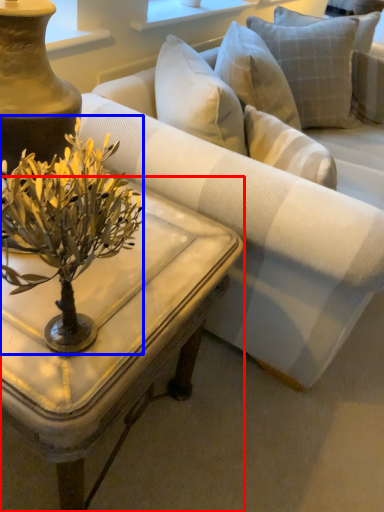
Question: Which object is further to the camera taking this photo, coffee table (highlighted by a red box) or flower (highlighted by a blue box)?

Choices:
 (A) coffee table
 (B) flower

Answer: (A)